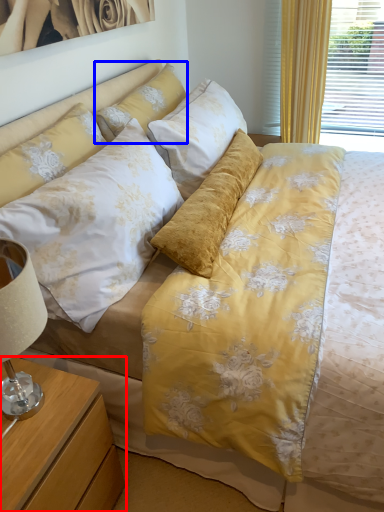
Question: Which object appears closest to the camera in this image, nightstand (highlighted by a red box) or pillow (highlighted by a blue box)?

Choices:
 (A) nightstand
 (B) pillow

Answer: (A)